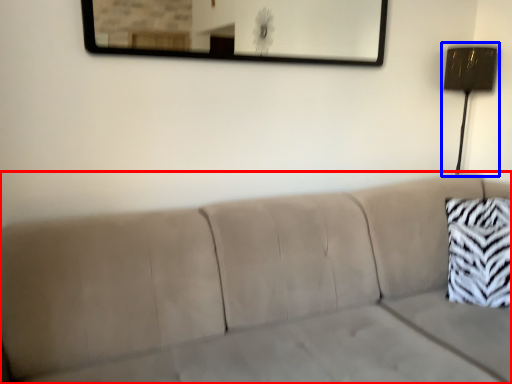
Question: Which object is closer to the camera taking this photo, studio couch (highlighted by a red box) or lamp (highlighted by a blue box)?

Choices:
 (A) studio couch
 (B) lamp

Answer: (A)